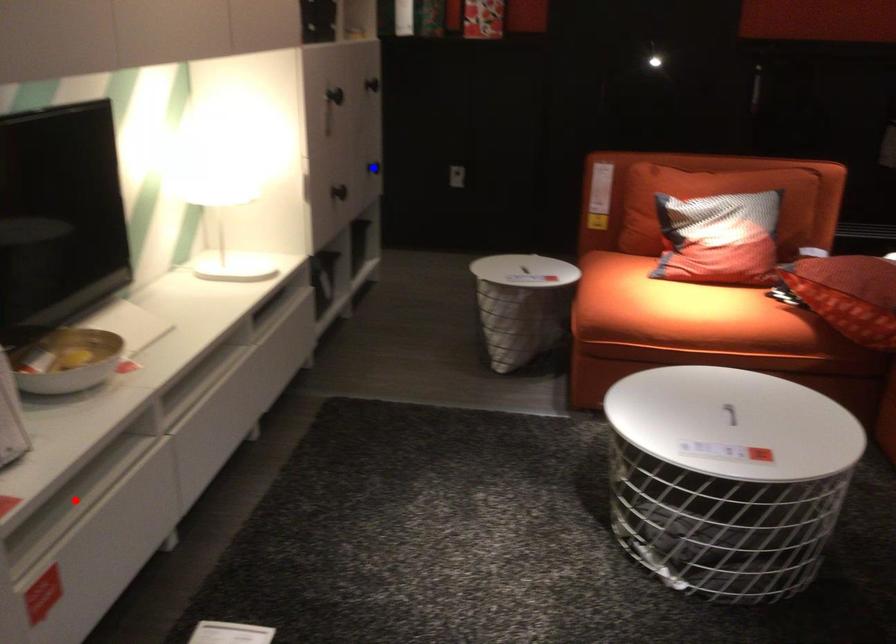
Question: In the image, two points are highlighted. Which point is nearer to the camera? Reply with the corresponding letter.

Choices:
 (A) blue point
 (B) red point

Answer: (B)